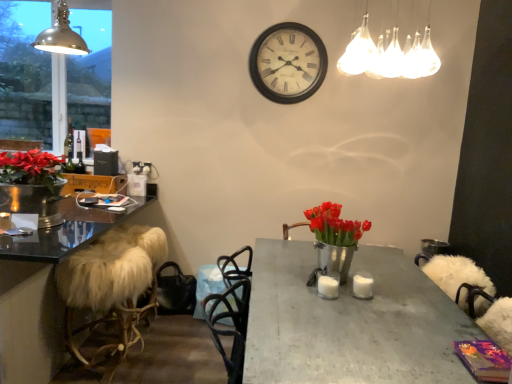
Question: Is metallic dome lamp at upper left, the 2th lamp in the right-to-left sequence, at the back of metallic glass window at upper left?

Choices:
 (A) yes
 (B) no

Answer: (B)

Question: Is metallic glass window at upper left located outside metallic dome lamp at upper left, the 2th lamp in the right-to-left sequence?

Choices:
 (A) no
 (B) yes

Answer: (B)

Question: From a real-world perspective, does metallic glass window at upper left sit lower than metallic dome lamp at upper left, which is the 1th lamp from left to right?

Choices:
 (A) yes
 (B) no

Answer: (A)

Question: Is metallic glass window at upper left in front of metallic dome lamp at upper left, which is the 2th lamp from front to back?

Choices:
 (A) yes
 (B) no

Answer: (B)

Question: Would you say metallic glass window at upper left is a long distance from metallic dome lamp at upper left, which is the 2th lamp from front to back?

Choices:
 (A) yes
 (B) no

Answer: (A)

Question: Does point (333, 286) appear closer or farther from the camera than point (344, 54)?

Choices:
 (A) closer
 (B) farther

Answer: (B)

Question: Is white matte candle at center, which appears as the 1th candle when viewed from the left, spatially inside translucent glass light fixture at upper center, positioned as the 1th lamp in right-to-left order, or outside of it?

Choices:
 (A) outside
 (B) inside

Answer: (A)

Question: From the image's perspective, is white matte candle at center, which appears as the 1th candle when viewed from the left, above or below translucent glass light fixture at upper center, which is the 1th lamp from front to back?

Choices:
 (A) below
 (B) above

Answer: (A)

Question: Is white matte candle at center, which is the 2th candle from right to left, wider or thinner than translucent glass light fixture at upper center, which is counted as the second lamp, starting from the back?

Choices:
 (A) thin
 (B) wide

Answer: (A)

Question: Based on their positions, is white fur-covered stool at left located to the left or right of white matte clock at upper center?

Choices:
 (A) right
 (B) left

Answer: (B)

Question: Based on their sizes in the image, would you say white fur-covered stool at left is bigger or smaller than white matte clock at upper center?

Choices:
 (A) big
 (B) small

Answer: (A)

Question: Is white fur-covered stool at left taller or shorter than white matte clock at upper center?

Choices:
 (A) short
 (B) tall

Answer: (B)

Question: Is point (115, 258) closer or farther from the camera than point (267, 64)?

Choices:
 (A) closer
 (B) farther

Answer: (A)

Question: Is metallic dome lamp at upper left, which is the 1th lamp from left to right, taller or shorter than white fur-covered stool at left?

Choices:
 (A) tall
 (B) short

Answer: (B)

Question: From the image's perspective, is metallic dome lamp at upper left, placed as the 1th lamp when sorted from back to front, above or below white fur-covered stool at left?

Choices:
 (A) below
 (B) above

Answer: (B)